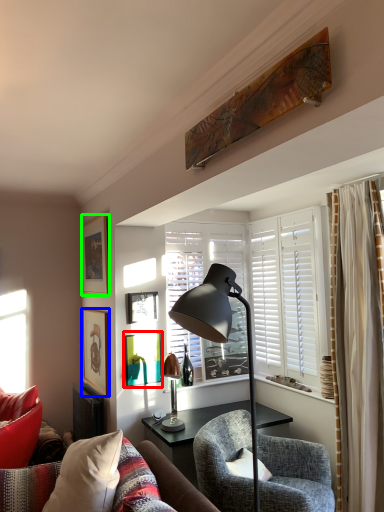
Question: Which is farther away from picture frame (highlighted by a red box)? picture frame (highlighted by a blue box) or picture frame (highlighted by a green box)?

Choices:
 (A) picture frame
 (B) picture frame

Answer: (B)